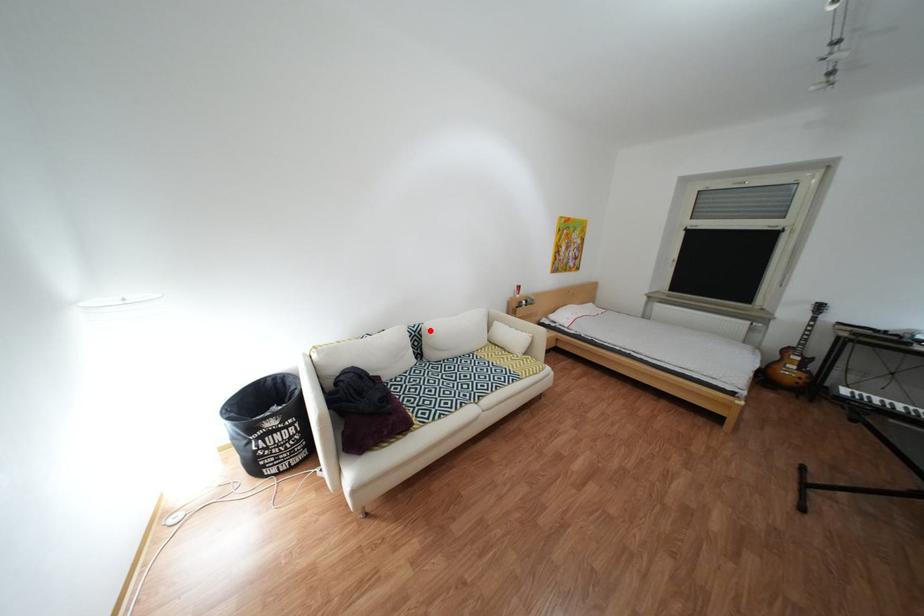
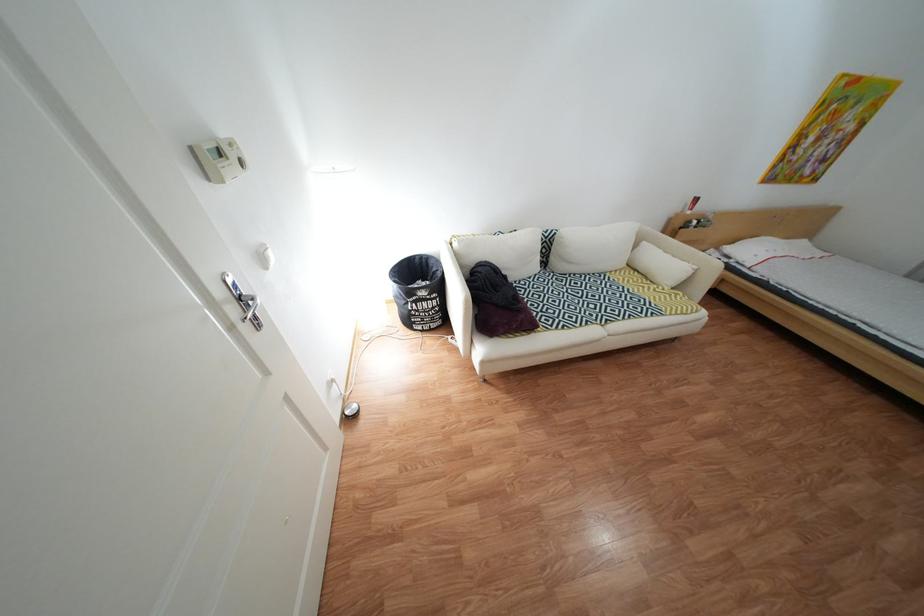
Question: A red point is marked in image1. In image2, is the corresponding 3D point closer to the camera or farther? Reply with the corresponding letter.

Choices:
 (A) The corresponding 3D point is closer.
 (B) The corresponding 3D point is farther.

Answer: (A)